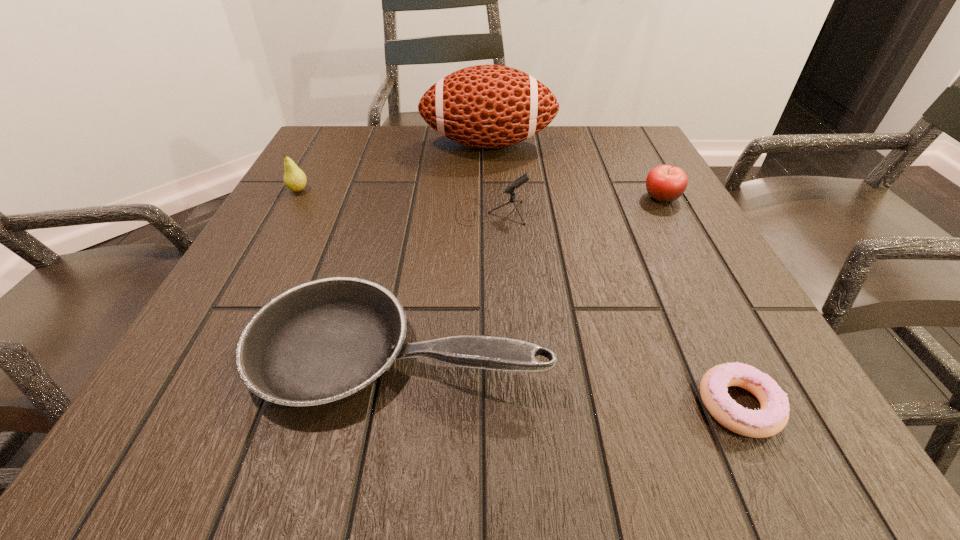
The image size is (960, 540). I want to click on the tallest object, so click(x=485, y=106).

Where is `the farthest object`? This screenshot has width=960, height=540. the farthest object is located at coordinates (485, 106).

In order to click on the leftmost object in this screenshot , I will do `click(295, 179)`.

This screenshot has height=540, width=960. Identify the location of microphone. point(521,180).

I want to click on apple, so click(664, 183).

You are a GUI agent. You are given a task and a screenshot of the screen. Output one action in this format:
    pyautogui.click(x=<x>, y=<y>)
    Task: Click on the frying pan
    Image resolution: width=960 pixels, height=540 pixels.
    Given the screenshot: What is the action you would take?
    pyautogui.click(x=321, y=342)

This screenshot has width=960, height=540. In order to click on the shortest object in this screenshot , I will do `click(773, 416)`.

Find the location of a particular element. This screenshot has width=960, height=540. vacant space situated on the right of the tallest object is located at coordinates (610, 144).

I want to click on free space located on the front of the pear, so (222, 327).

Where is `vacant space located on the stand of the microphone`? This screenshot has height=540, width=960. vacant space located on the stand of the microphone is located at coordinates (412, 212).